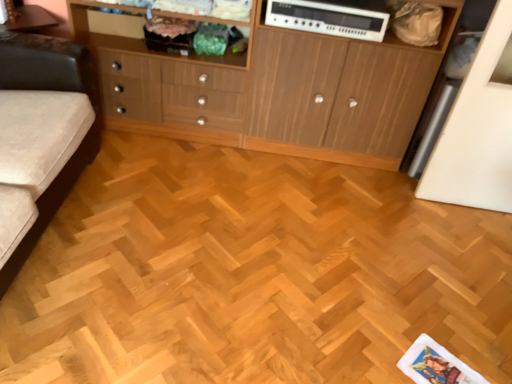
Question: Is wooden cabinet at center taller or shorter than white plastic stereo at upper center?

Choices:
 (A) tall
 (B) short

Answer: (A)

Question: Considering the positions of wooden cabinet at center and white plastic stereo at upper center in the image, is wooden cabinet at center wider or thinner than white plastic stereo at upper center?

Choices:
 (A) thin
 (B) wide

Answer: (B)

Question: Estimate the real-world distances between objects in this image. Which object is closer to the wooden cabinet at left?

Choices:
 (A) wooden cabinet at center
 (B) white plastic stereo at upper center
 (C) light brown wood parquet floor at center

Answer: (A)

Question: Based on their relative distances, which object is farther from the light brown wood parquet floor at center?

Choices:
 (A) wooden cabinet at center
 (B) white plastic stereo at upper center
 (C) wooden cabinet at left

Answer: (B)